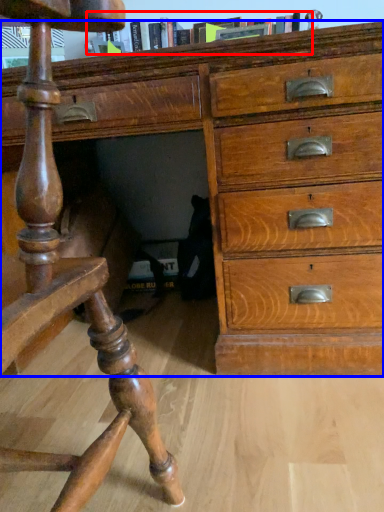
Question: Which object is closer to the camera taking this photo, book (highlighted by a red box) or chest of drawers (highlighted by a blue box)?

Choices:
 (A) book
 (B) chest of drawers

Answer: (B)